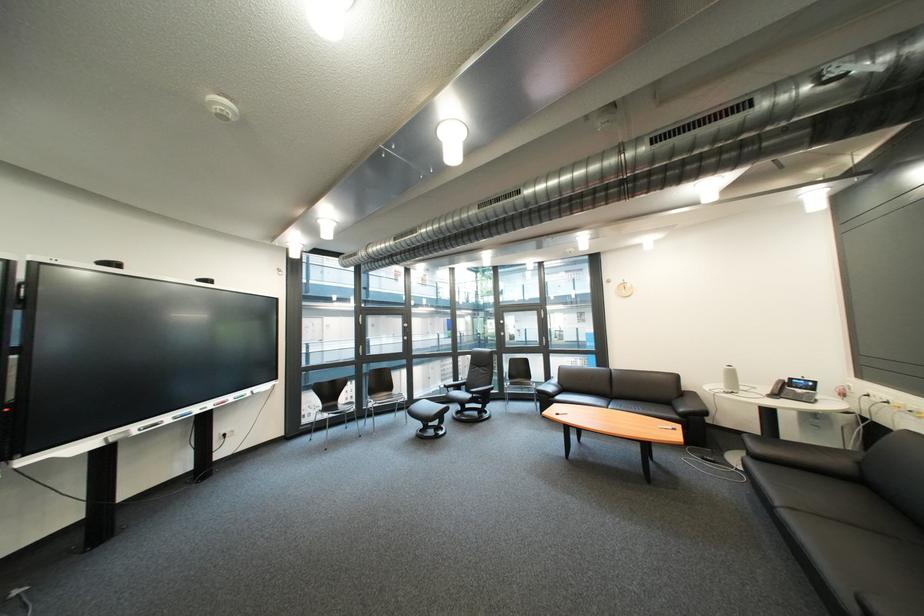
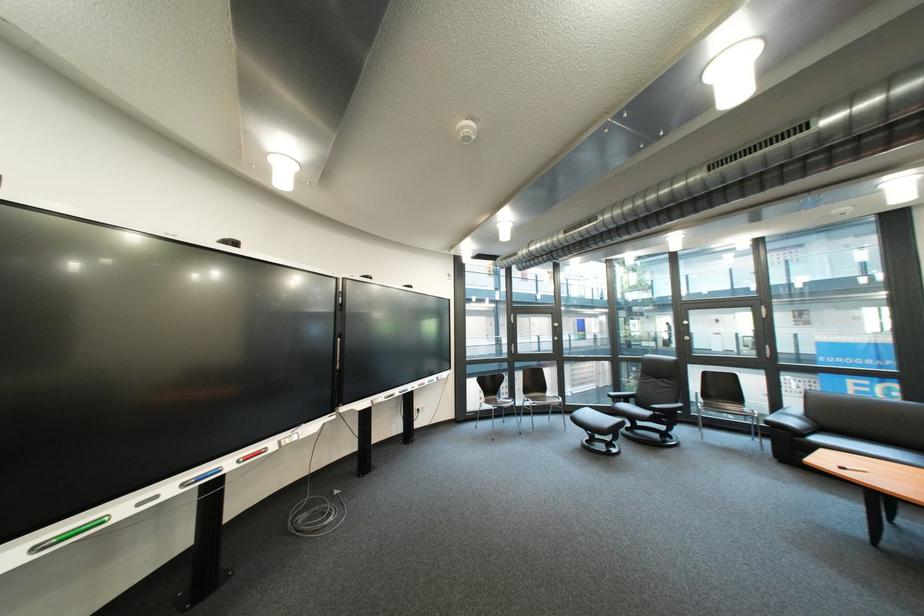
In the second image, find the point that corresponds to point 390,405 in the first image.

(548, 405)